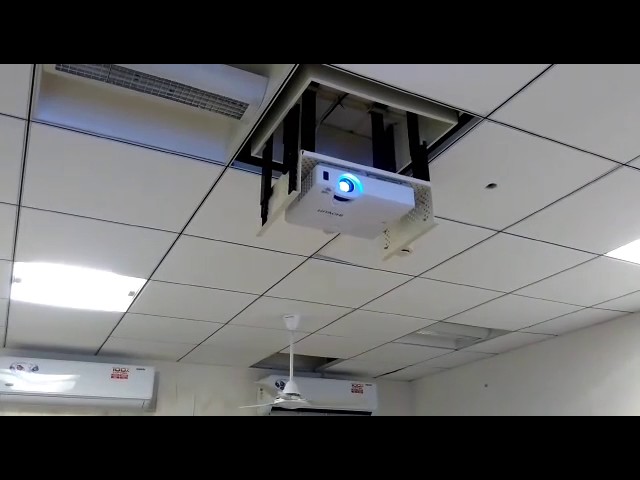
You are a GUI agent. You are given a task and a screenshot of the screen. Output one action in this format:
    pyautogui.click(x=<x>, y=<y>)
    Task: Click on the fire detector
    
    Given the screenshot: What is the action you would take?
    pyautogui.click(x=404, y=253)